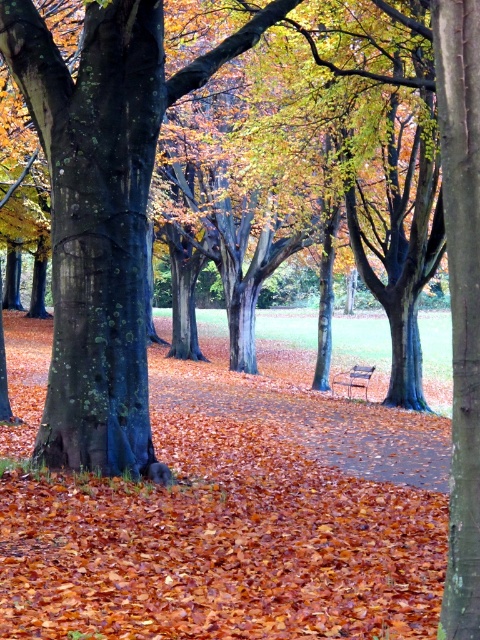
Is smooth bark tree at center to the left of wooden park bench at center from the viewer's perspective?

Yes, smooth bark tree at center is to the left of wooden park bench at center.

The width and height of the screenshot is (480, 640). Describe the element at coordinates (460, 298) in the screenshot. I see `smooth bark tree at center` at that location.

Identify the location of smooth bark tree at center. (460, 298).